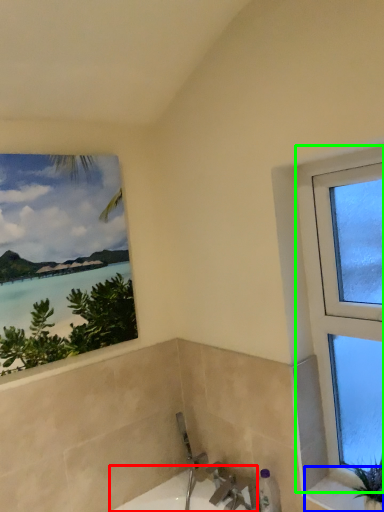
Question: Based on their relative distances, which object is farther from bath (highlighted by a red box)? Choose from window sill (highlighted by a blue box) and window (highlighted by a green box).

Choices:
 (A) window sill
 (B) window

Answer: (B)